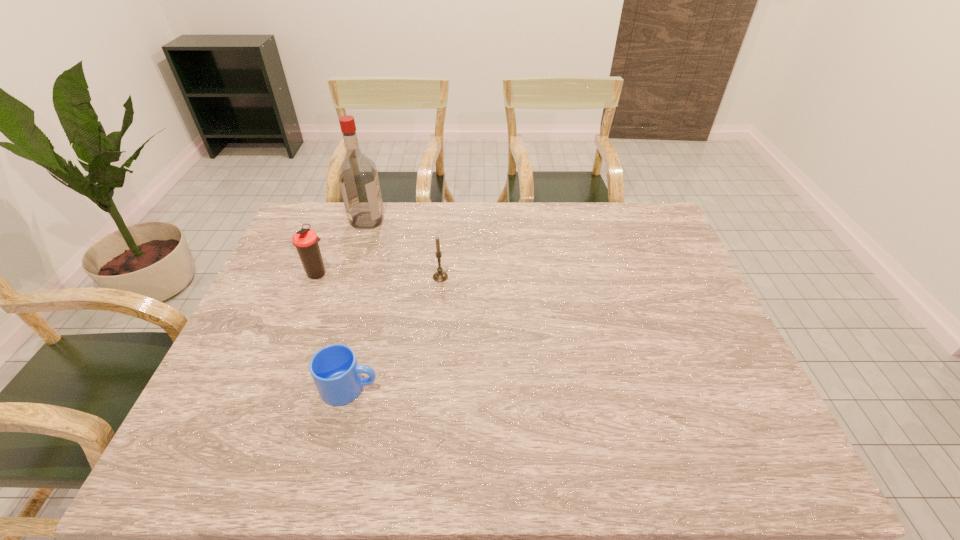
Image resolution: width=960 pixels, height=540 pixels. I want to click on object located at the far edge, so click(358, 178).

Image resolution: width=960 pixels, height=540 pixels. In order to click on object that is positioned at the left edge in this screenshot , I will do `click(306, 240)`.

Image resolution: width=960 pixels, height=540 pixels. Find the location of `vacant position at the far edge of the desktop`. vacant position at the far edge of the desktop is located at coordinates (491, 212).

Locate an element on the screen. This screenshot has height=540, width=960. blank space at the left edge of the desktop is located at coordinates (326, 270).

Where is `vacant space at the right edge`? The height and width of the screenshot is (540, 960). vacant space at the right edge is located at coordinates (645, 258).

Where is `blank space at the far left corner of the desktop`? The width and height of the screenshot is (960, 540). blank space at the far left corner of the desktop is located at coordinates (340, 207).

At what (x,y) coordinates should I click in order to perform the action: click on vacant space at the far right corner of the desktop. Please return your answer as a coordinate pair (x, y). Looking at the image, I should click on (628, 205).

Image resolution: width=960 pixels, height=540 pixels. What are the coordinates of `free space at the near right corner of the desktop` in the screenshot? It's located at point(736,449).

Where is `free spot between the mug and the thermos bottle`? free spot between the mug and the thermos bottle is located at coordinates (334, 330).

I want to click on unoccupied area between the farthest object and the rightmost object, so click(x=404, y=248).